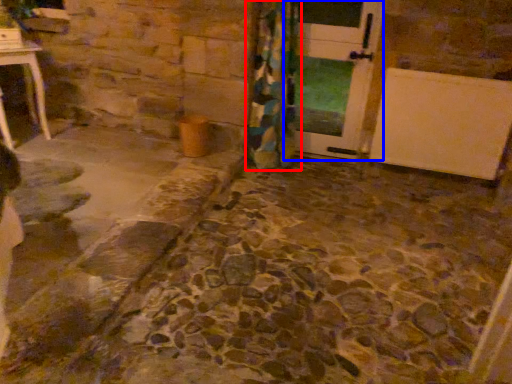
Question: Among these objects, which one is farthest to the camera, curtain (highlighted by a red box) or door (highlighted by a blue box)?

Choices:
 (A) curtain
 (B) door

Answer: (B)